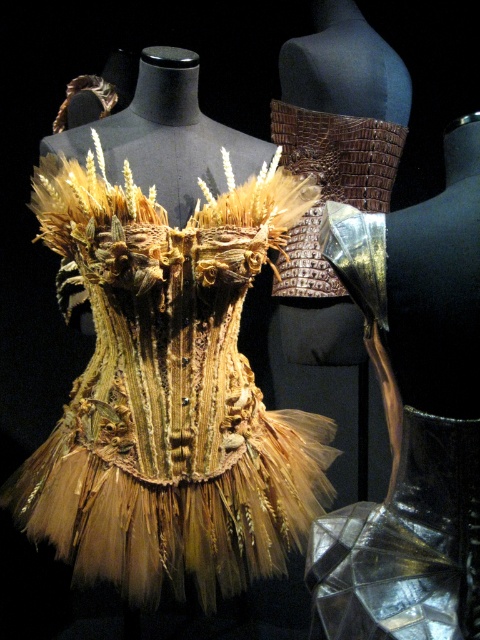
Does braided straw dress at center have a greater height compared to translucent tulle skirt at center?

Indeed, braided straw dress at center has a greater height compared to translucent tulle skirt at center.

Does braided straw dress at center appear over translucent tulle skirt at center?

Indeed, braided straw dress at center is positioned over translucent tulle skirt at center.

What are the coordinates of `braided straw dress at center` in the screenshot? It's located at (169, 390).

Where is `braided straw dress at center`? braided straw dress at center is located at coordinates (169, 390).

Can you confirm if braided straw dress at center is positioned above leather-like brown corset at center?

No, braided straw dress at center is not above leather-like brown corset at center.

Between braided straw dress at center and leather-like brown corset at center, which one has less height?

With less height is braided straw dress at center.

Is point (127, 525) closer to camera compared to point (285, 360)?

Yes, point (127, 525) is closer to viewer.

At what (x,y) coordinates should I click in order to perform the action: click on braided straw dress at center. Please return your answer as a coordinate pair (x, y). Looking at the image, I should click on (169, 390).

Who is more distant from viewer, [287,49] or [468,636]?

The point [287,49] is more distant.

Which of these two, leather-like brown corset at center or translucent tulle skirt at center, stands shorter?

translucent tulle skirt at center

At what (x,y) coordinates should I click in order to perform the action: click on leather-like brown corset at center. Please return your answer as a coordinate pair (x, y). The width and height of the screenshot is (480, 640). Looking at the image, I should click on (343, 106).